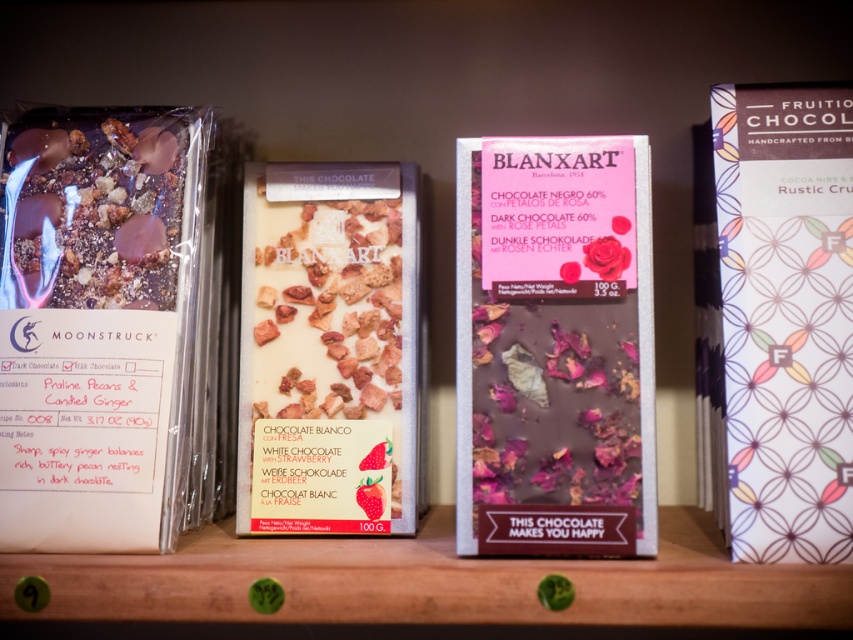
Who is more distant from viewer, [99,538] or [399,404]?

The point [399,404] is more distant.

Is point (54, 481) positioned before point (410, 372)?

Yes, point (54, 481) is in front of point (410, 372).

Locate an element on the screen. The height and width of the screenshot is (640, 853). matte dark chocolate bar at left is located at coordinates (97, 323).

Measure the distance between white matte chocolate bar at right and camera.

white matte chocolate bar at right and camera are 20.34 inches apart from each other.

Which is in front, point (779, 500) or point (386, 275)?

Point (779, 500) is more forward.

Is point (759, 461) positioned before point (399, 232)?

Yes, it is.

Locate an element on the screen. The height and width of the screenshot is (640, 853). white matte chocolate bar at right is located at coordinates (786, 316).

Does matte dark chocolate bar at left come in front of white chocolate with rose petals at center?

Yes, it is in front of white chocolate with rose petals at center.

Identify the location of matte dark chocolate bar at left. (97, 323).

Locate an element on the screen. matte dark chocolate bar at left is located at coordinates (97, 323).